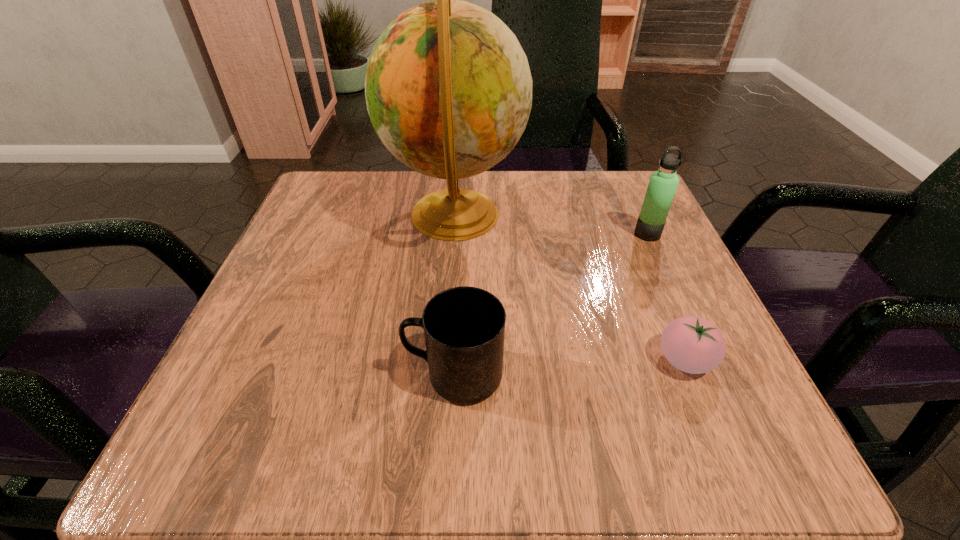
The width and height of the screenshot is (960, 540). What are the coordinates of `vacant space at the far left corner of the desktop` in the screenshot? It's located at (302, 215).

Image resolution: width=960 pixels, height=540 pixels. What are the coordinates of `vacant area at the far right corner of the desktop` in the screenshot? It's located at (640, 200).

Where is `vacant space that's between the shortest object and the tallest object`? The height and width of the screenshot is (540, 960). vacant space that's between the shortest object and the tallest object is located at coordinates click(x=570, y=287).

Find the location of `vacant space in between the thermos bottle and the third tallest object`. vacant space in between the thermos bottle and the third tallest object is located at coordinates (551, 304).

Where is `vacant space in between the mug and the second tallest object`? vacant space in between the mug and the second tallest object is located at coordinates [x=551, y=304].

The width and height of the screenshot is (960, 540). I want to click on vacant space that is in between the tallest object and the thermos bottle, so click(x=551, y=224).

The width and height of the screenshot is (960, 540). I want to click on free spot between the shortest object and the tallest object, so click(570, 287).

Locate an element on the screen. blank region between the third shortest object and the shortest object is located at coordinates (666, 297).

The image size is (960, 540). What are the coordinates of `unoccupied position between the thermos bottle and the globe` in the screenshot? It's located at (551, 224).

You are a GUI agent. You are given a task and a screenshot of the screen. Output one action in this format:
    pyautogui.click(x=<x>, y=<y>)
    Task: Click on the free space that is in between the third shortest object and the third tallest object
    Image resolution: width=960 pixels, height=540 pixels.
    Given the screenshot: What is the action you would take?
    pyautogui.click(x=551, y=304)